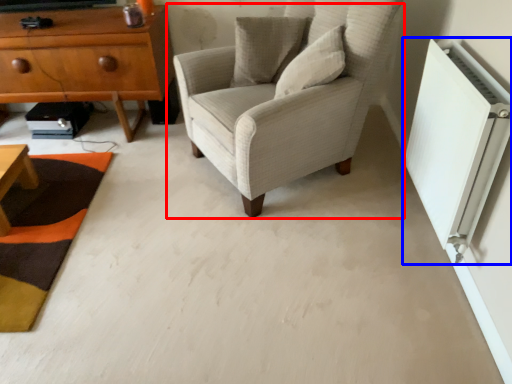
Question: Which object is further to the camera taking this photo, chair (highlighted by a red box) or air conditioning (highlighted by a blue box)?

Choices:
 (A) chair
 (B) air conditioning

Answer: (A)